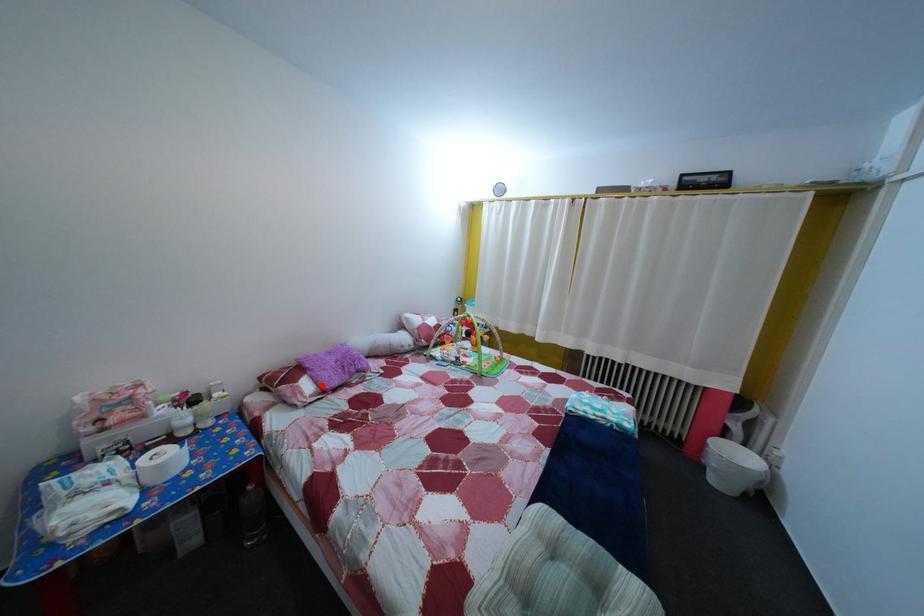
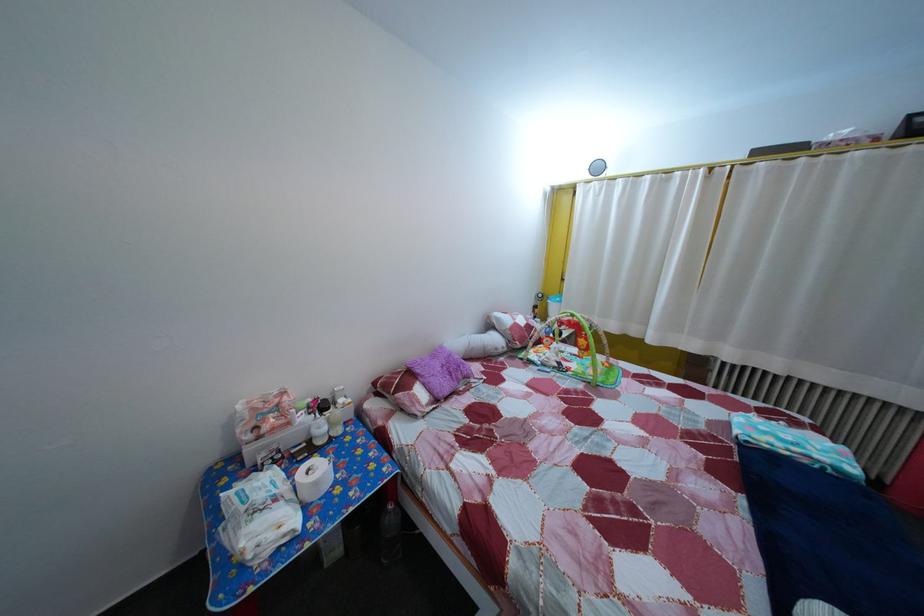
The point at the highlighted location is marked in the first image. Where is the corresponding point in the second image?

(433, 392)